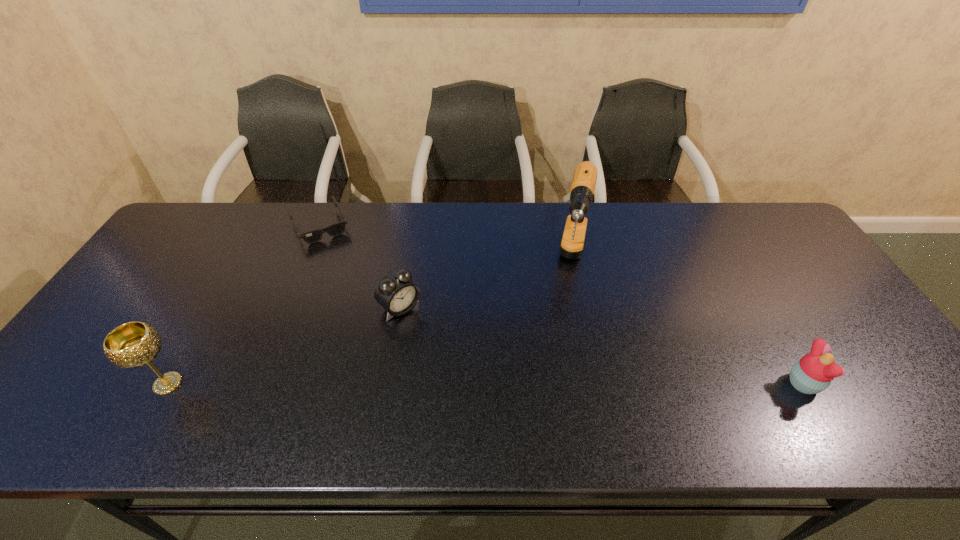
Find the location of a particular element. The width and height of the screenshot is (960, 540). vacant space that's between the second object from right to left and the second object from left to right is located at coordinates pyautogui.click(x=446, y=244).

Locate an element on the screen. vacant area between the tallest object and the third object from right to left is located at coordinates (487, 285).

Locate an element on the screen. The height and width of the screenshot is (540, 960). free point between the tallest object and the rightmost object is located at coordinates (688, 323).

What are the coordinates of `blank region between the cupcake and the tallest object` in the screenshot? It's located at (688, 323).

The image size is (960, 540). Find the location of `free space between the fourth object from left to right and the sunglasses`. free space between the fourth object from left to right and the sunglasses is located at coordinates (446, 244).

Find the location of a particular element. The image size is (960, 540). unoccupied area between the third object from left to right and the cupcake is located at coordinates (602, 346).

You are a GUI agent. You are given a task and a screenshot of the screen. Output one action in this format:
    pyautogui.click(x=<x>, y=<y>)
    Task: Click on the vacant space in between the third object from left to right and the fourth shortest object
    The height and width of the screenshot is (540, 960).
    Given the screenshot: What is the action you would take?
    pyautogui.click(x=284, y=346)

Where is `vacant point located between the cupcake and the shortest object`? This screenshot has width=960, height=540. vacant point located between the cupcake and the shortest object is located at coordinates (562, 305).

In order to click on the third closest object to the rightmost object in this screenshot , I will do `click(314, 236)`.

This screenshot has height=540, width=960. In order to click on object that is the second closest one to the chalice in this screenshot , I will do `click(314, 236)`.